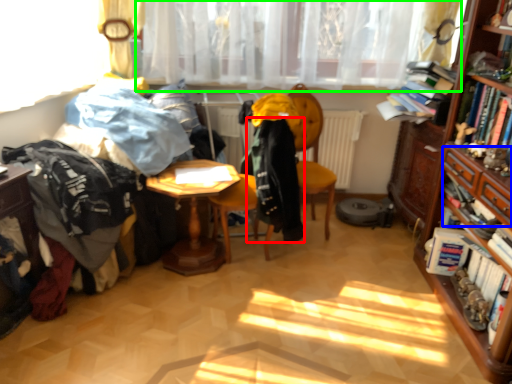
Question: Based on their relative distances, which object is nearer to clothing (highlighted by a red box)? Choose from drawer (highlighted by a blue box) and curtain (highlighted by a green box).

Choices:
 (A) drawer
 (B) curtain

Answer: (B)